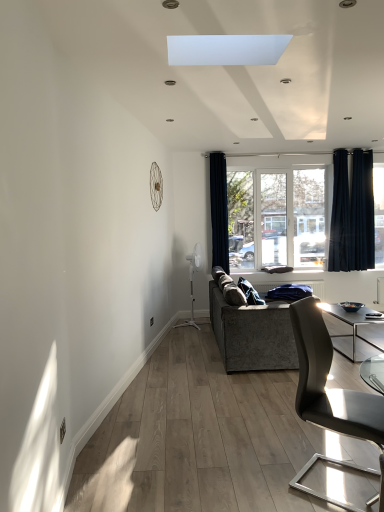
Question: In terms of height, does textured gray couch at center look taller or shorter compared to blue fabric at center?

Choices:
 (A) short
 (B) tall

Answer: (B)

Question: Is textured gray couch at center wider or thinner than blue fabric at center?

Choices:
 (A) thin
 (B) wide

Answer: (B)

Question: Which object is the closest to the matte black chair at lower right?

Choices:
 (A) textured gray couch at center
 (B) black sheer curtain at right, which is the second curtain from left to right
 (C) clear glass window at center
 (D) blue fabric at center
 (E) dark blue fabric curtain at center, which is counted as the third curtain, starting from the right

Answer: (A)

Question: Which of these objects is positioned farthest from the black sheer curtain at right, which is the second curtain from left to right?

Choices:
 (A) textured gray couch at center
 (B) clear glass window at center
 (C) matte black chair at lower right
 (D) blue fabric at center
 (E) dark blue fabric curtain at center, marked as the 1th curtain in a left-to-right arrangement

Answer: (C)